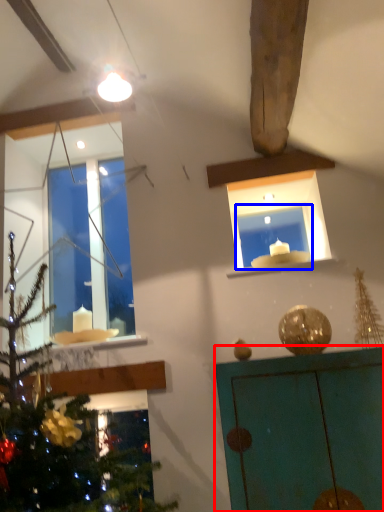
Question: Which object appears closest to the camera in this image, furniture (highlighted by a red box) or window frame (highlighted by a blue box)?

Choices:
 (A) furniture
 (B) window frame

Answer: (A)